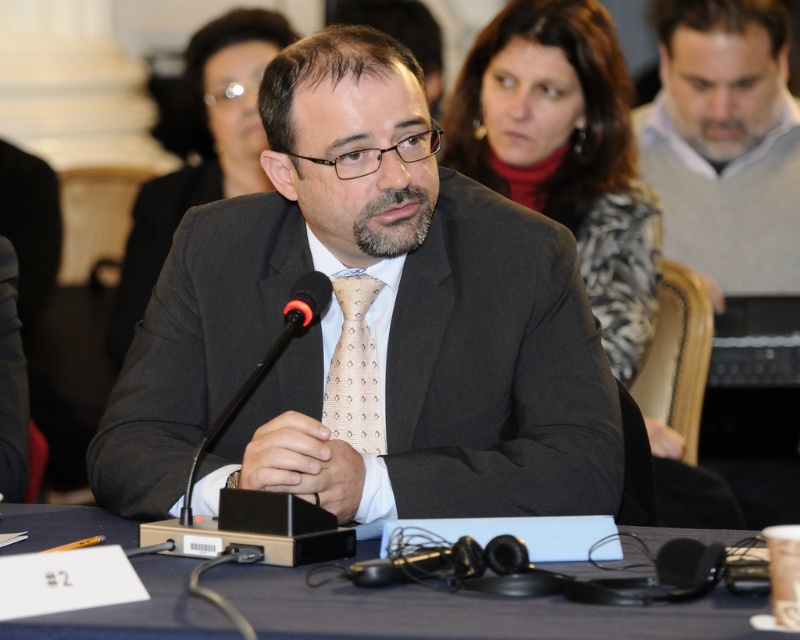
You are an event planner organizing a photo shoot for a professional event. You need to arrange two participants wearing the matte black suit at center and the gray sweater at right. Based on their clothing descriptions, which participant should stand closer to the camera to ensure both appear equally tall in the photo?

The matte black suit at center has a lesser height compared to gray sweater at right. To make them appear equally tall in the photo, the participant in the matte black suit at center should stand closer to the camera since they are shorter in height.

You are organizing a presentation and need to place a name tag on the table. The name tag is the same width as the black plastic microphone at center. Will it fit between the gray sweater at right and the edge of the table?

The gray sweater at right is wider than the black plastic microphone at center. Since the name tag has the same width as the microphone, it will fit between the gray sweater at right and the edge of the table because the sweater is wider, leaving enough space.

You are organizing a conference and need to ensure the microphone is accessible for the speaker. Is the black plastic microphone at center visible and unobstructed by the gray sweater at right?

The gray sweater at right is positioned over the black plastic microphone at center, so it is obstructing the microphone and making it less visible. The speaker may need to adjust the sweater to access the microphone properly.